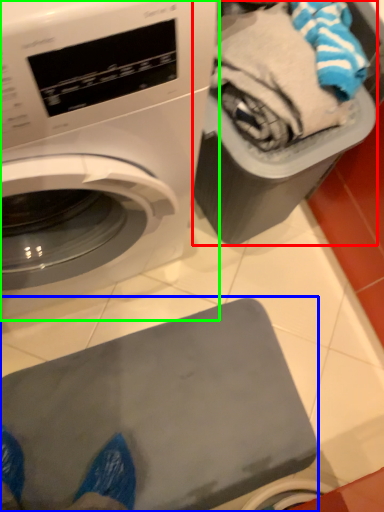
Question: Considering the real-world distances, which object is farthest from garbage (highlighted by a red box)? appliance (highlighted by a blue box) or washing machine (highlighted by a green box)?

Choices:
 (A) appliance
 (B) washing machine

Answer: (A)